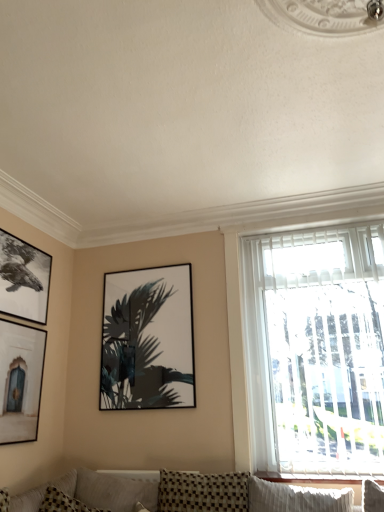
Question: Considering the positions of point (241, 262) and point (130, 372), is point (241, 262) closer or farther from the camera than point (130, 372)?

Choices:
 (A) farther
 (B) closer

Answer: (A)

Question: Based on their positions, is white textured blinds at right located to the left or right of matte black picture frame at center, arranged as the 1th picture frame when viewed from the right?

Choices:
 (A) right
 (B) left

Answer: (A)

Question: Based on their relative distances, which object is nearer to the white textured blinds at right?

Choices:
 (A) checkered fabric pillow at lower left
 (B) matte black picture frame at left, which is the 2th picture frame from right to left
 (C) white wood window sill at lower right
 (D) matte black picture frame at center, which is the third picture frame in left-to-right order
 (E) black matte picture frame at upper left, the third picture frame positioned from the right

Answer: (C)

Question: Which of these objects is positioned closest to the black matte picture frame at upper left, the third picture frame positioned from the right?

Choices:
 (A) checkered fabric pillow at lower left
 (B) matte black picture frame at left, which is the 2th picture frame from right to left
 (C) white textured blinds at right
 (D) matte black picture frame at center, which is the third picture frame in left-to-right order
 (E) white wood window sill at lower right

Answer: (B)